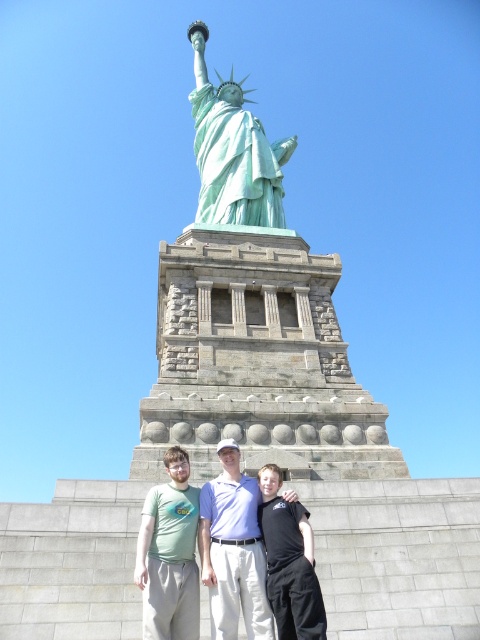
Can you confirm if green patina statue at center is shorter than light blue shirt at center?

No.

Is point (233, 176) closer to camera compared to point (255, 502)?

No, it is not.

Between point (248, 189) and point (256, 602), which one is positioned in front?

Point (256, 602) is in front.

The width and height of the screenshot is (480, 640). Find the location of `green patina statue at center`. green patina statue at center is located at coordinates (232, 150).

Can you confirm if green matte t-shirt at center is positioned above black cotton shirt at center?

No, green matte t-shirt at center is not above black cotton shirt at center.

Does green matte t-shirt at center appear on the right side of black cotton shirt at center?

Incorrect, green matte t-shirt at center is not on the right side of black cotton shirt at center.

The height and width of the screenshot is (640, 480). Describe the element at coordinates (169, 554) in the screenshot. I see `green matte t-shirt at center` at that location.

This screenshot has width=480, height=640. Find the location of `green matte t-shirt at center`. green matte t-shirt at center is located at coordinates (169, 554).

Between light blue shirt at center and green matte t-shirt at center, which one appears on the right side from the viewer's perspective?

Positioned to the right is light blue shirt at center.

Is point (216, 634) behind point (184, 573)?

No.

Is point (240, 452) farther from viewer compared to point (144, 637)?

Yes, it is.

Where is `light blue shirt at center`? light blue shirt at center is located at coordinates (233, 550).